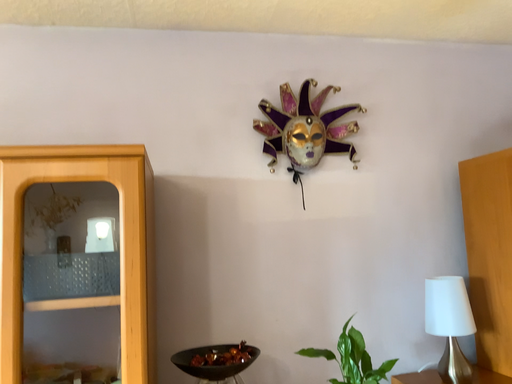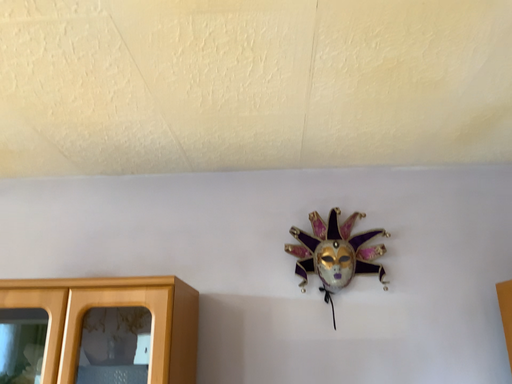
Question: Which way did the camera rotate in the video?

Choices:
 (A) rotated upward
 (B) rotated downward

Answer: (A)